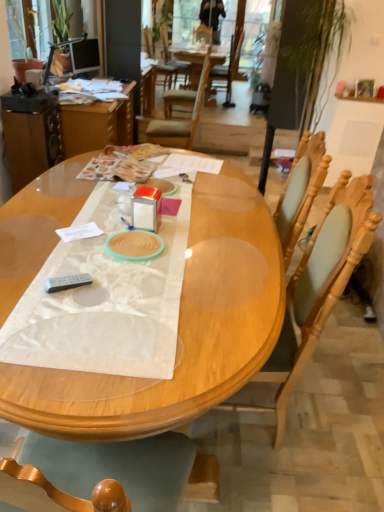
This screenshot has height=512, width=384. In order to click on vacant space situated on the left part of gray matte remote control at lower left in this screenshot , I will do `click(39, 282)`.